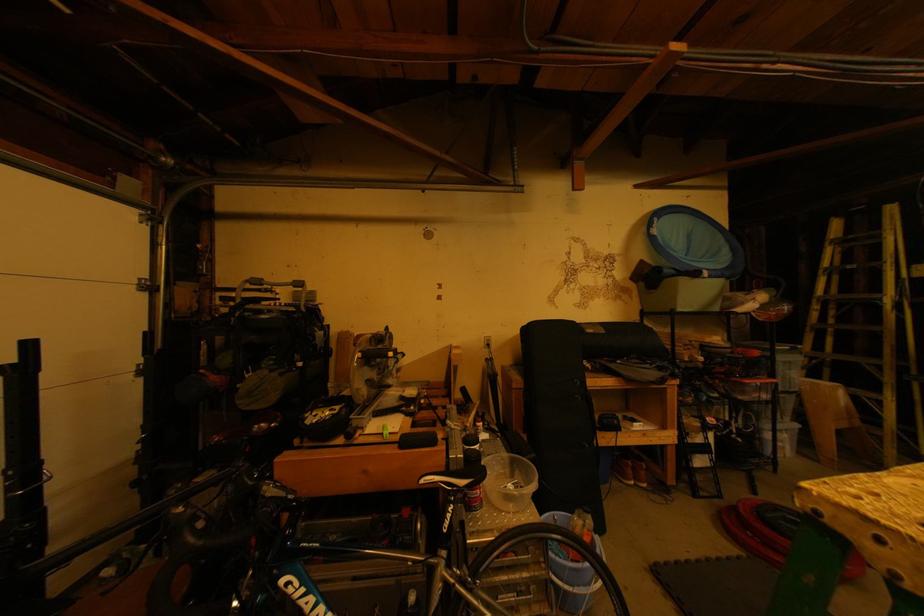
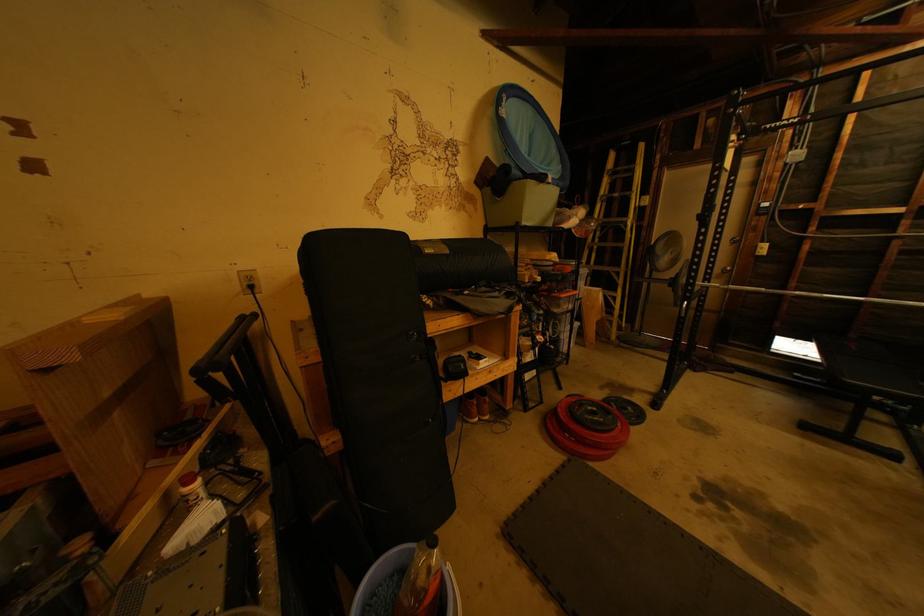
The images are taken continuously from a first-person perspective. In which direction is your viewpoint rotating?

The camera rotated toward right-down.